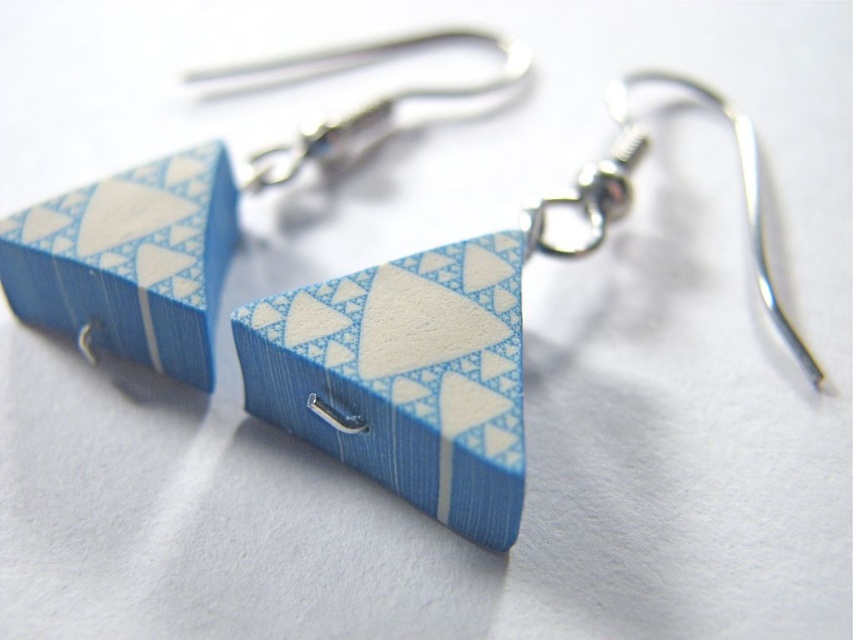
Question: Based on their relative distances, which object is farther from the silver metallic hook at upper center?

Choices:
 (A) blue wood triangle at center
 (B) blue paper triangle at center
 (C) matte blue wood triangle at center

Answer: (B)

Question: Is blue wood triangle at center positioned at the back of silver metallic hook at upper center?

Choices:
 (A) no
 (B) yes

Answer: (A)

Question: Does matte blue wood triangle at center appear over blue wood triangle at center?

Choices:
 (A) yes
 (B) no

Answer: (B)

Question: Which point is farther from the camera taking this photo?

Choices:
 (A) (x=28, y=216)
 (B) (x=357, y=115)
 (C) (x=537, y=234)

Answer: (B)

Question: Which object is positioned closest to the blue wood triangle at center?

Choices:
 (A) blue paper triangle at center
 (B) silver metallic hook at upper center

Answer: (B)

Question: Is blue wood triangle at center positioned before silver metallic hook at upper center?

Choices:
 (A) yes
 (B) no

Answer: (A)